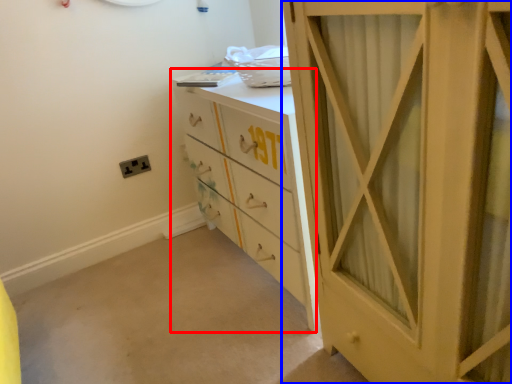
Question: Which point is closer to the camera, chest of drawers (highlighted by a red box) or cupboard (highlighted by a blue box)?

Choices:
 (A) chest of drawers
 (B) cupboard

Answer: (B)